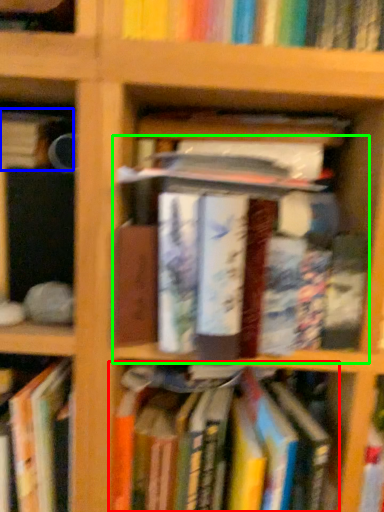
Question: Which is farther away from book (highlighted by a red box)? book (highlighted by a blue box) or book (highlighted by a green box)?

Choices:
 (A) book
 (B) book

Answer: (A)